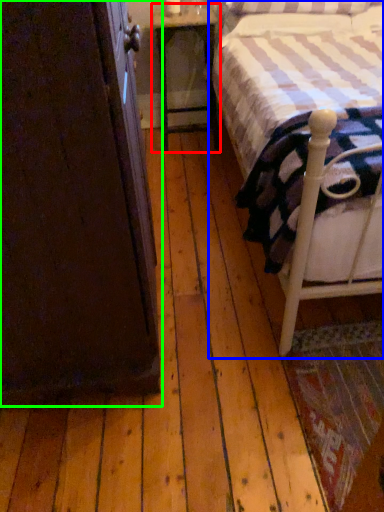
Question: Considering the real-world distances, which object is farthest from nightstand (highlighted by a red box)? bed (highlighted by a blue box) or armoire (highlighted by a green box)?

Choices:
 (A) bed
 (B) armoire

Answer: (B)